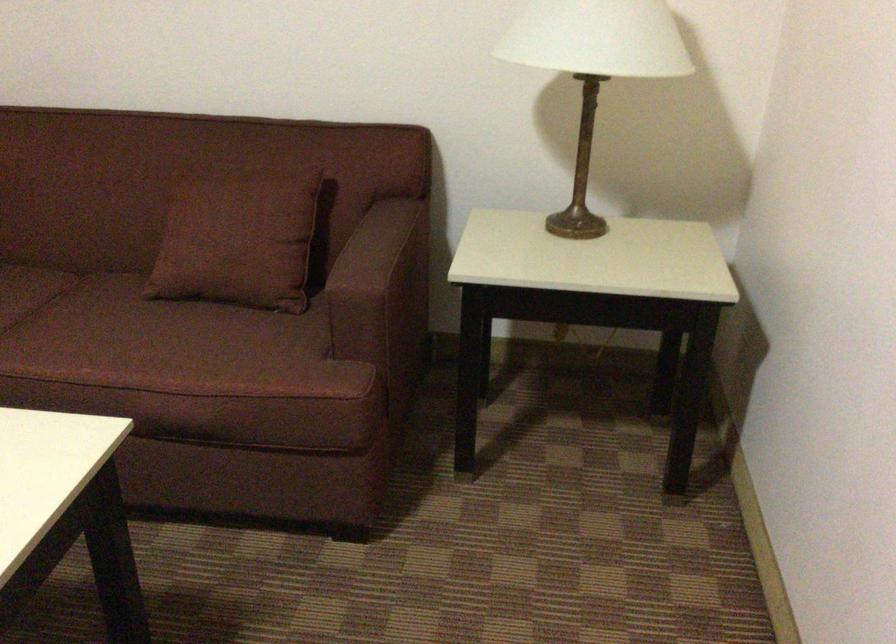
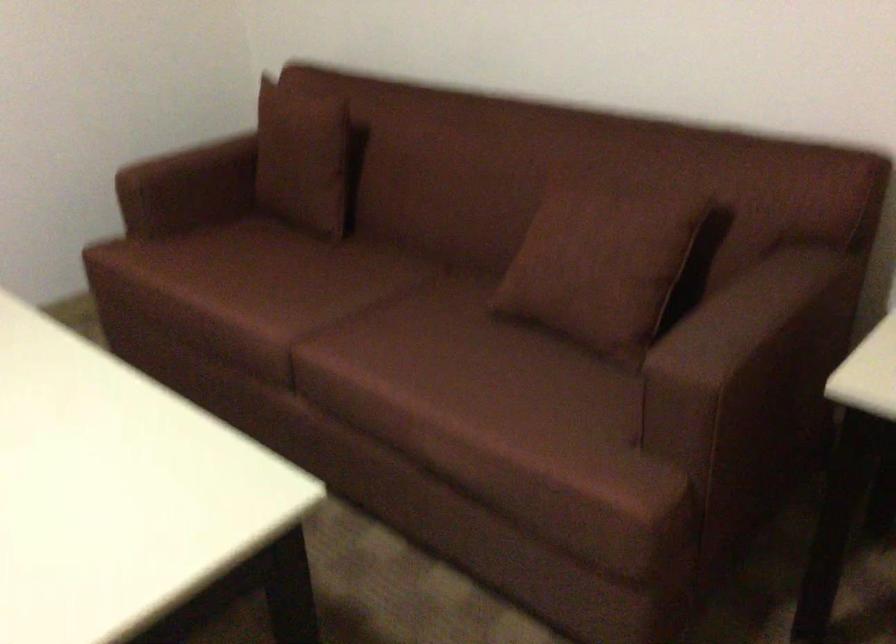
In the second image, find the point that corresponds to point 414,346 in the first image.

(791, 446)